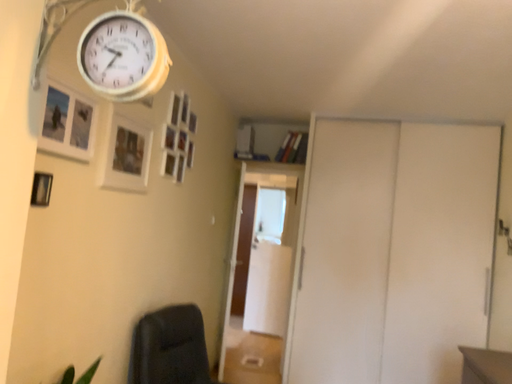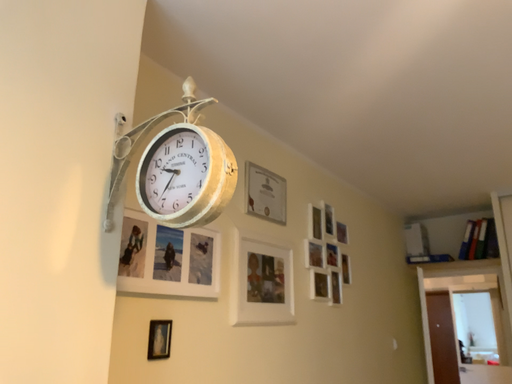
Question: How did the camera likely rotate when shooting the video?

Choices:
 (A) rotated left
 (B) rotated right

Answer: (A)